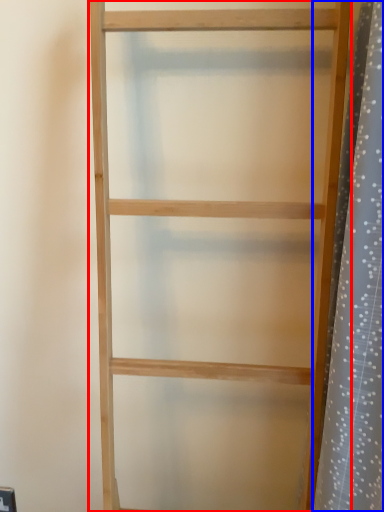
Question: Which of the following is the closest to the observer, shelf (highlighted by a red box) or shower curtain (highlighted by a blue box)?

Choices:
 (A) shelf
 (B) shower curtain

Answer: (A)